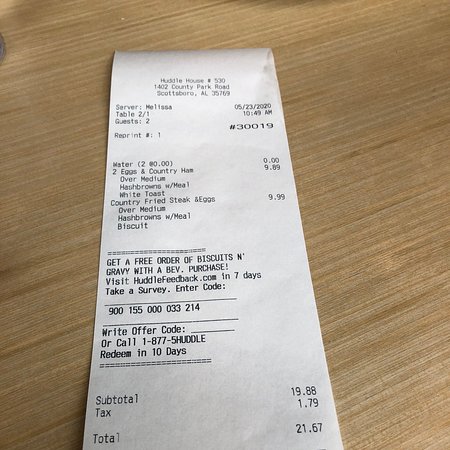
I want to click on top edge of table, so click(x=100, y=20), click(x=355, y=33).